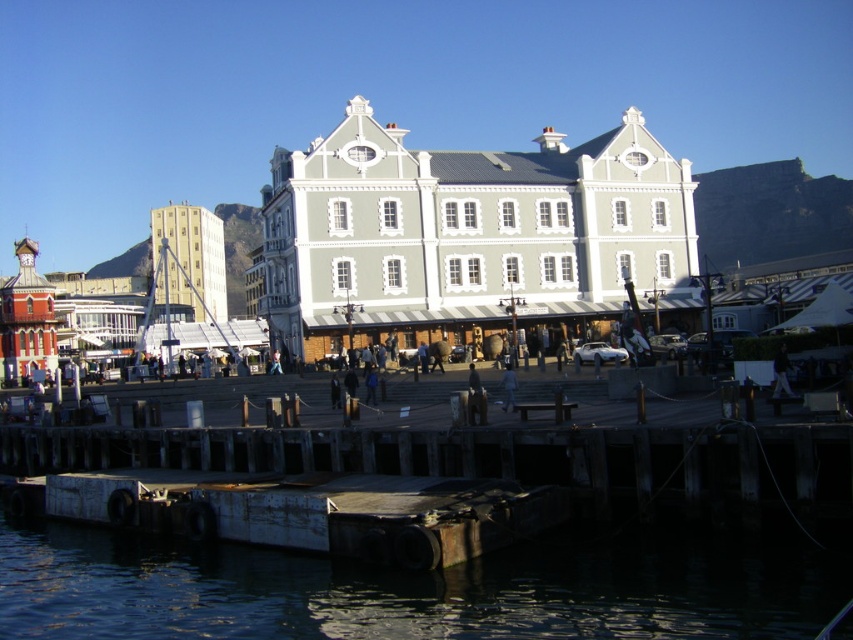
Question: Is dark gray water at lower left behind rusty metal dock at lower center?

Choices:
 (A) no
 (B) yes

Answer: (A)

Question: Which object is the farthest from the dark gray water at lower left?

Choices:
 (A) dark gray jacket at center
 (B) rusty metal dock at lower center

Answer: (A)

Question: Can you confirm if dark gray water at lower left is positioned below rusty metal dock at lower center?

Choices:
 (A) yes
 (B) no

Answer: (A)

Question: Which point is closer to the camera?

Choices:
 (A) (737, 595)
 (B) (776, 352)
 (C) (238, 520)
 (D) (508, 365)

Answer: (A)

Question: Which object is positioned farthest from the dark gray jacket at center?

Choices:
 (A) dark blue fabric at center
 (B) rusty metal dock at lower center
 (C) dark gray water at lower left

Answer: (B)

Question: Does dark gray water at lower left lie in front of dark gray jacket at center?

Choices:
 (A) no
 (B) yes

Answer: (B)